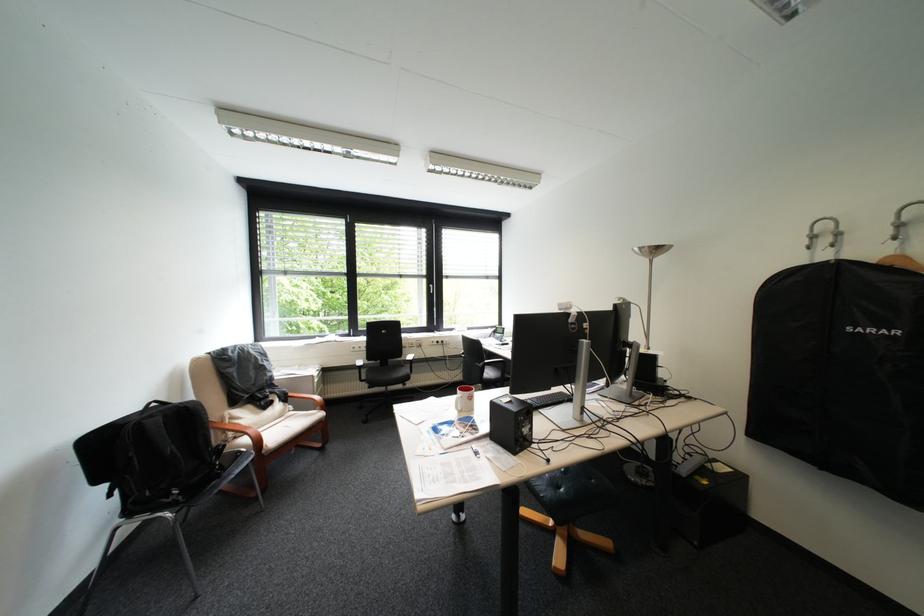
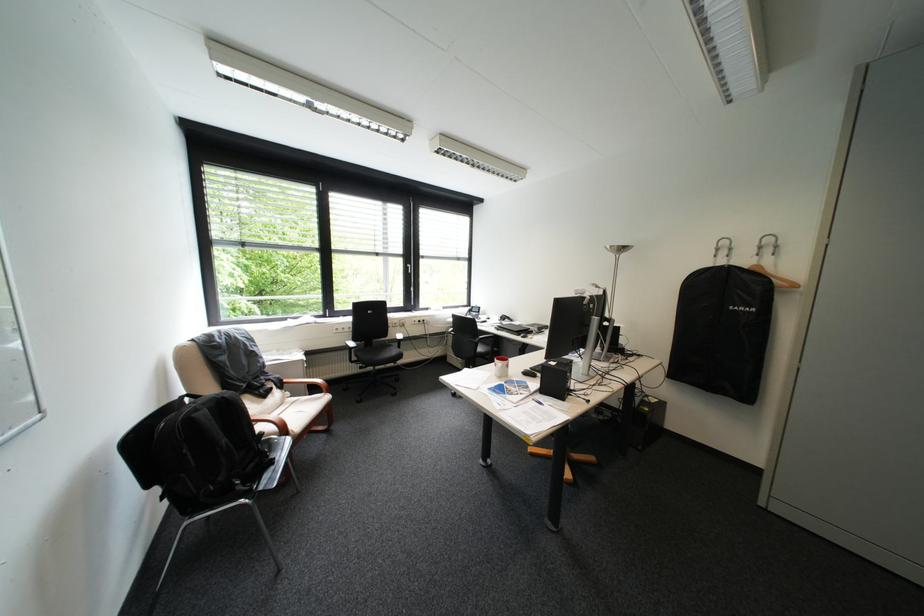
Locate, in the second image, the point that corresponds to [199,407] in the first image.

(236, 398)